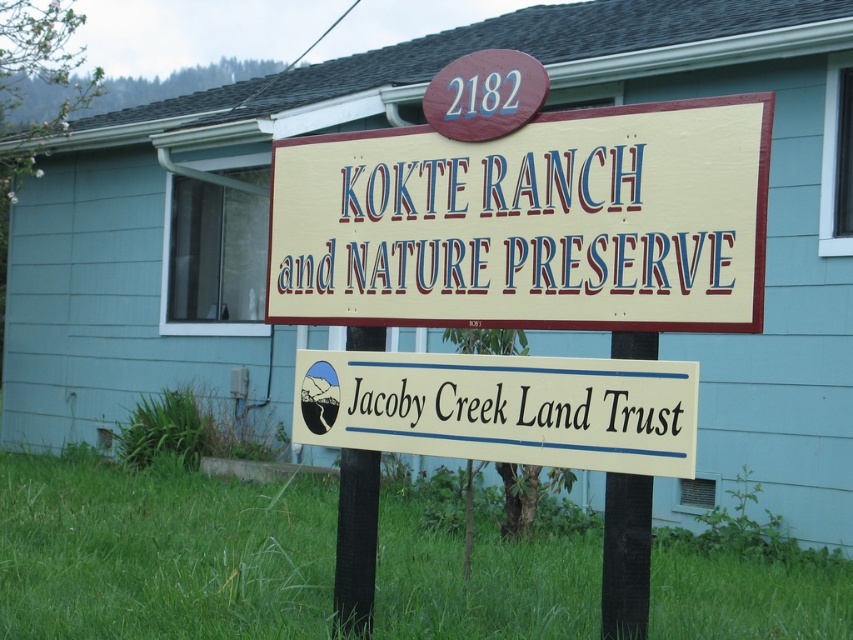
You are a hiker who just arrived at the trailhead and see the beige wood sign at center and the white painted wood jacoby creek land trust at center. Which sign is closer to you?

The beige wood sign at center is closer to you because it is in front of the white painted wood jacoby creek land trust at center.

You are standing at the signboard for Kokte Ranch and Nature Preserve. You want to reach a point that is exactly 13.30 feet away from where you are currently standing. Can you determine if the point at coordinate point [582,112] is the correct location to reach?

The distance of point [582,112] from camera is 13.30 feet, so yes, the point at coordinate point [582,112] is exactly 13.30 feet away from where you are currently standing.